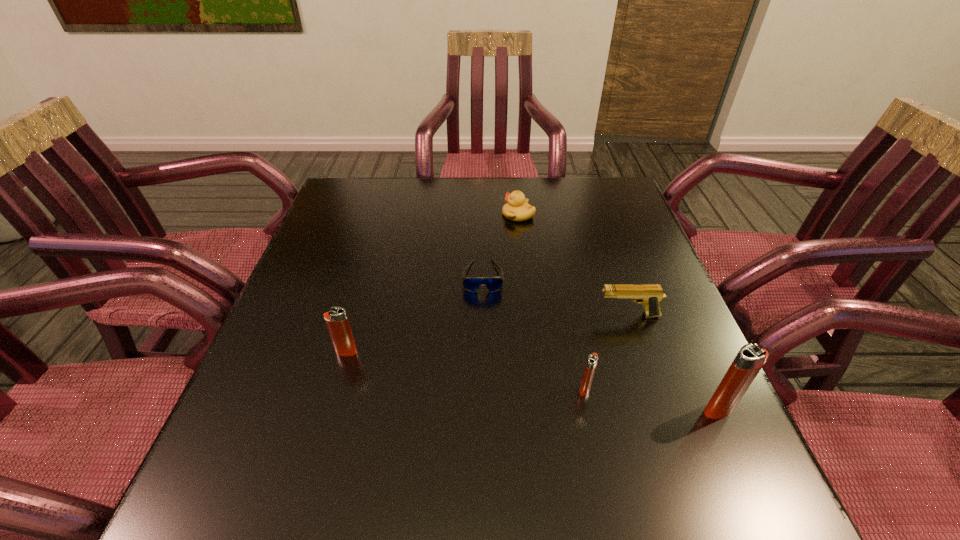
Locate an element on the screen. Image resolution: width=960 pixels, height=540 pixels. empty space between the tallest object and the second farthest igniter is located at coordinates (652, 399).

Locate an element on the screen. The image size is (960, 540). vacant space in between the second nearest object and the fourth object from right to left is located at coordinates (552, 302).

Identify the location of empty location between the second farthest igniter and the sunglasses. The width and height of the screenshot is (960, 540). (534, 333).

Identify the location of vacant area that lies between the leftmost object and the rightmost igniter. (533, 381).

Image resolution: width=960 pixels, height=540 pixels. I want to click on object that can be found as the closest to the fifth shortest object, so click(x=471, y=283).

You are a GUI agent. You are given a task and a screenshot of the screen. Output one action in this format:
    pyautogui.click(x=<x>, y=<y>)
    Task: Click on the fifth closest object to the fifth shortest object
    
    Given the screenshot: What is the action you would take?
    pyautogui.click(x=750, y=359)

Select which igniter appears as the closest to the fourth object from left to right. Please provide its 2D coordinates. Your answer should be formatted as a tuple, i.e. [(x, y)], where the tuple contains the x and y coordinates of a point satisfying the conditions above.

[(750, 359)]

The height and width of the screenshot is (540, 960). I want to click on igniter that is the closest to the second farthest object, so click(x=337, y=322).

Find the location of `free space in the image that satisfies the following two spatial constraints: 1. at the barrel of the fourth nearest object; 2. on the right side of the rightmost object`. free space in the image that satisfies the following two spatial constraints: 1. at the barrel of the fourth nearest object; 2. on the right side of the rightmost object is located at coordinates (660, 410).

Where is `vacant point that satisfies the following two spatial constraints: 1. on the front-facing side of the duckling; 2. on the front-facing side of the second farthest object`? The image size is (960, 540). vacant point that satisfies the following two spatial constraints: 1. on the front-facing side of the duckling; 2. on the front-facing side of the second farthest object is located at coordinates (525, 276).